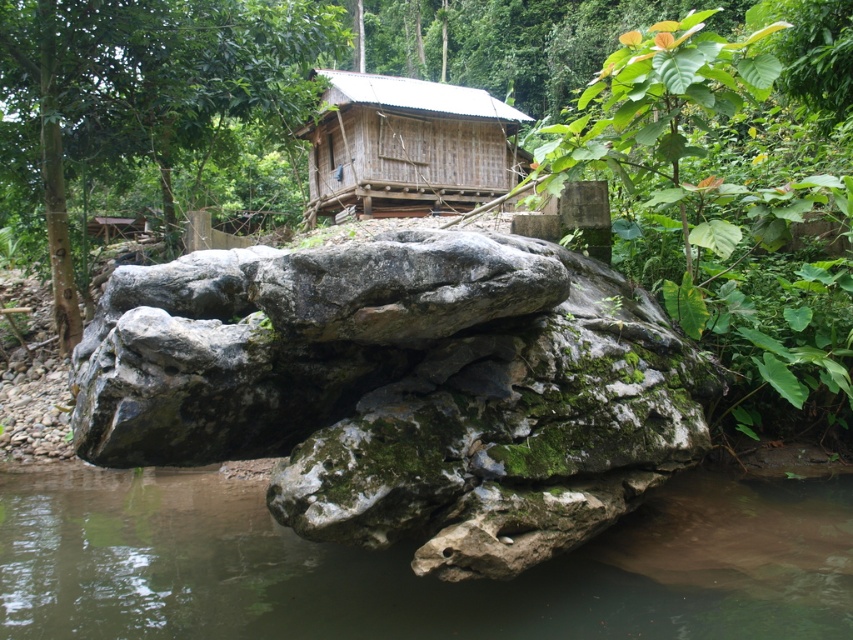
You are planning to place a small garden shed that is 2 meters wide in this area. Given the space occupied by the mossy stone rock at center and the wooden cabin at center, do you think there is enough room for your shed?

The mossy stone rock at center is wider than the wooden cabin at center. Since the shed is 2 meters wide, it depends on the actual dimensions of the rock and cabin. However, since the rock is wider, there might not be sufficient space unless the cabin is positioned strategically.

You are standing in the serene natural setting and want to move from the mossy stone rock at center to the wooden cabin at center. Which direction should you head to reach the cabin?

A: The mossy stone rock at center is to the right of the wooden cabin at center, so you should head to the left to reach the cabin.

In the scene shown: You are standing at the base of the large rock formation in the image. There are two points marked on the rock surface, one at coordinates point (x=534, y=422) and another at point (x=111, y=509). Which of these points is closer to you?

Point (x=534, y=422) is closer to the viewer than point (x=111, y=509).